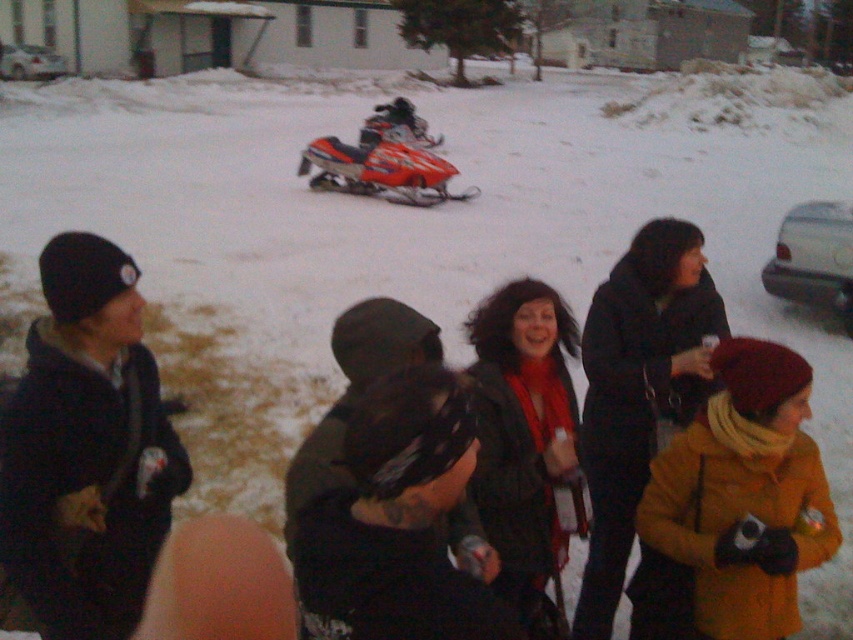
Question: Which of these objects is positioned closest to the shiny orange snowmobile at center?

Choices:
 (A) black matte jacket at left
 (B) orange matte jacket at lower right
 (C) black matte jacket at center

Answer: (B)

Question: Estimate the real-world distances between objects in this image. Which object is closer to the black matte jacket at left?

Choices:
 (A) black matte jacket at center
 (B) dark green jacket at center

Answer: (B)

Question: Does dark gray coat at center have a larger size compared to dark green jacket at center?

Choices:
 (A) yes
 (B) no

Answer: (A)

Question: Does black matte jacket at left have a greater width compared to dark gray coat at center?

Choices:
 (A) no
 (B) yes

Answer: (A)

Question: Which object appears farthest from the camera in this image?

Choices:
 (A) black matte jacket at center
 (B) dark gray coat at center

Answer: (B)

Question: Is orange matte jacket at lower right bigger than shiny orange snowmobile at center?

Choices:
 (A) no
 (B) yes

Answer: (A)